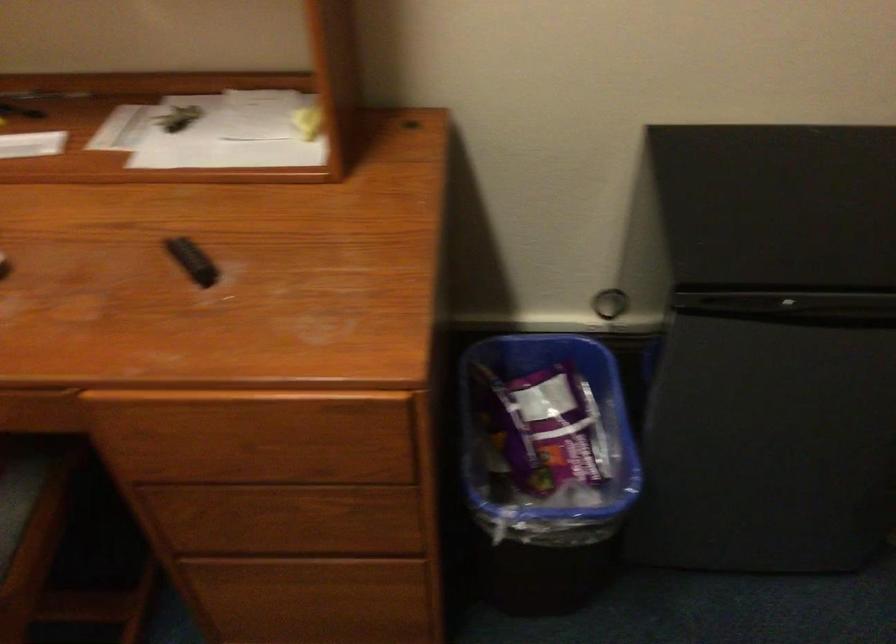
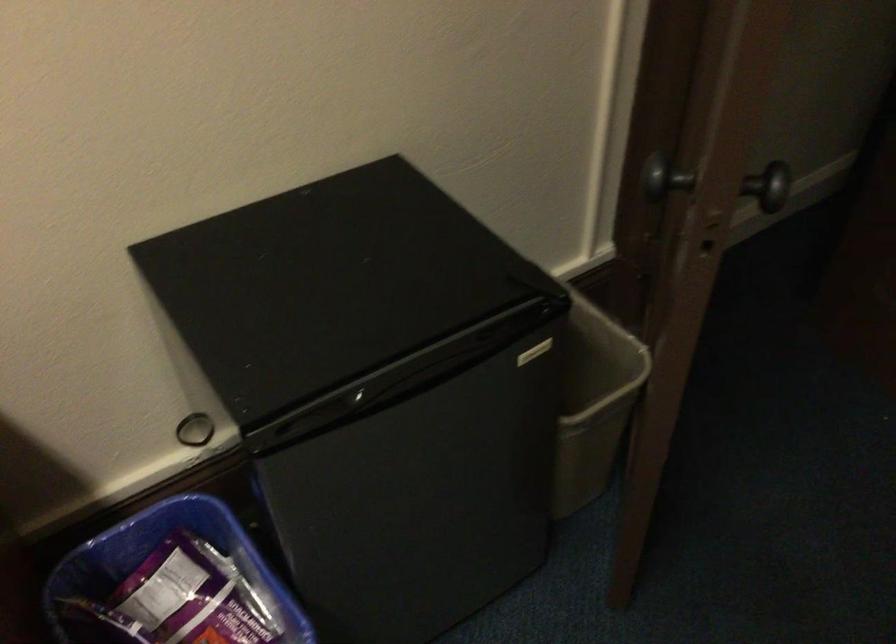
Question: The camera is either moving clockwise (left) or counter-clockwise (right) around the object. The first image is from the beginning of the video and the second image is from the end. Is the camera moving left or right when shooting the video?

Choices:
 (A) Left
 (B) Right

Answer: (A)